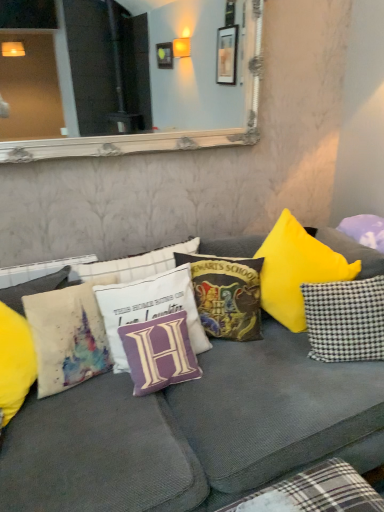
The height and width of the screenshot is (512, 384). I want to click on purple fabric pillow at center, which appears as the 3th pillow when viewed from the left, so click(159, 353).

The width and height of the screenshot is (384, 512). What do you see at coordinates (192, 430) in the screenshot?
I see `textured gray couch at center` at bounding box center [192, 430].

What is the approximate height of velvet hogwarts school of witchcraft and wizardry pillow at center, the 3th pillow from the right?

It is 15.96 inches.

What do you see at coordinates (149, 308) in the screenshot?
I see `white fabric pillow with purple letter h at center, the 5th pillow when ordered from right to left` at bounding box center [149, 308].

The height and width of the screenshot is (512, 384). What are the coordinates of `checkered fabric pillow at right, marked as the second pillow in a right-to-left arrangement` in the screenshot? It's located at (345, 319).

You are a GUI agent. You are given a task and a screenshot of the screen. Output one action in this format:
    pyautogui.click(x=<x>, y=<y>)
    Task: Click on the white textured mirror at upper center
    The image size is (384, 512).
    Given the screenshot: What is the action you would take?
    pyautogui.click(x=134, y=140)

Describe the element at coordinates (134, 140) in the screenshot. I see `white textured mirror at upper center` at that location.

What do you see at coordinates (68, 336) in the screenshot? The image size is (384, 512). I see `watercolor fabric pillow at left, which is counted as the 6th pillow, starting from the right` at bounding box center [68, 336].

Find the location of a particular element. The width and height of the screenshot is (384, 512). purple fabric pillow at center, which is the 4th pillow in right-to-left order is located at coordinates (159, 353).

Does point (367, 340) lie in front of point (164, 381)?

That is False.

Is there a large distance between checkered fabric pillow at right, marked as the second pillow in a right-to-left arrangement, and purple fabric pillow at center, which appears as the 3th pillow when viewed from the left?

checkered fabric pillow at right, marked as the second pillow in a right-to-left arrangement, is actually quite close to purple fabric pillow at center, which appears as the 3th pillow when viewed from the left.

Between checkered fabric pillow at right, marked as the second pillow in a right-to-left arrangement, and purple fabric pillow at center, which appears as the 3th pillow when viewed from the left, which one has less height?

purple fabric pillow at center, which appears as the 3th pillow when viewed from the left.

Consider the image. From the image's perspective, which one is positioned lower, checkered fabric pillow at right, which appears as the 5th pillow when viewed from the left, or purple fabric pillow at center, which appears as the 3th pillow when viewed from the left?

From the image's view, purple fabric pillow at center, which appears as the 3th pillow when viewed from the left, is below.

Is white textured mirror at upper center not inside purple fabric pillow at right, the sixth pillow when ordered from left to right?

Yes, white textured mirror at upper center is located beyond the bounds of purple fabric pillow at right, the sixth pillow when ordered from left to right.

Is white textured mirror at upper center turned away from purple fabric pillow at right, the 1th pillow when ordered from right to left?

No, purple fabric pillow at right, the 1th pillow when ordered from right to left, is not at the back of white textured mirror at upper center.

Does point (258, 137) lie behind point (382, 262)?

Yes, it is behind point (382, 262).

From a real-world perspective, which is physically below, white textured mirror at upper center or purple fabric pillow at right, the 1th pillow when ordered from right to left?

In real-world perspective, purple fabric pillow at right, the 1th pillow when ordered from right to left, is lower.

Is checkered fabric pillow at right, which appears as the 5th pillow when viewed from the left, oriented towards purple fabric pillow at right, the sixth pillow when ordered from left to right?

No, checkered fabric pillow at right, which appears as the 5th pillow when viewed from the left, is not oriented towards purple fabric pillow at right, the sixth pillow when ordered from left to right.

From a real-world perspective, between checkered fabric pillow at right, marked as the second pillow in a right-to-left arrangement, and purple fabric pillow at right, the sixth pillow when ordered from left to right, who is vertically higher?

purple fabric pillow at right, the sixth pillow when ordered from left to right, from a real-world perspective.

Is checkered fabric pillow at right, marked as the second pillow in a right-to-left arrangement, inside or outside of purple fabric pillow at right, the 1th pillow when ordered from right to left?

checkered fabric pillow at right, marked as the second pillow in a right-to-left arrangement, is spatially situated outside purple fabric pillow at right, the 1th pillow when ordered from right to left.

Can you tell me how much checkered fabric pillow at right, marked as the second pillow in a right-to-left arrangement, and purple fabric pillow at right, the 1th pillow when ordered from right to left, differ in facing direction?

The angular difference between checkered fabric pillow at right, marked as the second pillow in a right-to-left arrangement, and purple fabric pillow at right, the 1th pillow when ordered from right to left, is 61.4 degrees.

Based on the photo, from the image's perspective, which one is positioned lower, watercolor fabric pillow at left, the first pillow from the left, or white fabric pillow with purple letter h at center, the 5th pillow when ordered from right to left?

watercolor fabric pillow at left, the first pillow from the left, from the image's perspective.

How much distance is there between watercolor fabric pillow at left, which is counted as the 6th pillow, starting from the right, and white fabric pillow with purple letter h at center, the 5th pillow when ordered from right to left?

watercolor fabric pillow at left, which is counted as the 6th pillow, starting from the right, is 6.52 inches away from white fabric pillow with purple letter h at center, the 5th pillow when ordered from right to left.

Locate an element on the screen. the 2nd pillow in front of the white fabric pillow with purple letter h at center, which is the 2th pillow in left-to-right order is located at coordinates (68, 336).

Is watercolor fabric pillow at left, the first pillow from the left, spatially inside white fabric pillow with purple letter h at center, which is the 2th pillow in left-to-right order, or outside of it?

The correct answer is: outside.

From a real-world perspective, between checkered fabric pillow at right, which appears as the 5th pillow when viewed from the left, and textured gray couch at center, who is vertically lower?

textured gray couch at center is physically lower.

Which object is thinner, checkered fabric pillow at right, marked as the second pillow in a right-to-left arrangement, or textured gray couch at center?

With smaller width is checkered fabric pillow at right, marked as the second pillow in a right-to-left arrangement.

Is checkered fabric pillow at right, which appears as the 5th pillow when viewed from the left, closer to the viewer compared to textured gray couch at center?

No, it is behind textured gray couch at center.

From a real-world perspective, who is located higher, watercolor fabric pillow at left, which is counted as the 6th pillow, starting from the right, or checkered fabric pillow at right, which appears as the 5th pillow when viewed from the left?

In real-world perspective, watercolor fabric pillow at left, which is counted as the 6th pillow, starting from the right, is above.

From the image's perspective, between watercolor fabric pillow at left, the first pillow from the left, and checkered fabric pillow at right, marked as the second pillow in a right-to-left arrangement, who is located below?

watercolor fabric pillow at left, the first pillow from the left, from the image's perspective.

Considering the sizes of objects watercolor fabric pillow at left, which is counted as the 6th pillow, starting from the right, and checkered fabric pillow at right, marked as the second pillow in a right-to-left arrangement, in the image provided, who is smaller, watercolor fabric pillow at left, which is counted as the 6th pillow, starting from the right, or checkered fabric pillow at right, marked as the second pillow in a right-to-left arrangement,?

Smaller between the two is checkered fabric pillow at right, marked as the second pillow in a right-to-left arrangement.

Which is behind, watercolor fabric pillow at left, which is counted as the 6th pillow, starting from the right, or checkered fabric pillow at right, which appears as the 5th pillow when viewed from the left?

checkered fabric pillow at right, which appears as the 5th pillow when viewed from the left, is behind.

How different are the orientations of purple fabric pillow at center, which is the 4th pillow in right-to-left order, and checkered fabric pillow at right, marked as the second pillow in a right-to-left arrangement, in degrees?

The angular difference between purple fabric pillow at center, which is the 4th pillow in right-to-left order, and checkered fabric pillow at right, marked as the second pillow in a right-to-left arrangement, is 28.6 degrees.

Considering their positions, is purple fabric pillow at center, which is the 4th pillow in right-to-left order, located in front of or behind checkered fabric pillow at right, marked as the second pillow in a right-to-left arrangement?

purple fabric pillow at center, which is the 4th pillow in right-to-left order, is in front of checkered fabric pillow at right, marked as the second pillow in a right-to-left arrangement.

Is purple fabric pillow at center, which appears as the 3th pillow when viewed from the left, placed right next to checkered fabric pillow at right, which appears as the 5th pillow when viewed from the left?

No, purple fabric pillow at center, which appears as the 3th pillow when viewed from the left, is not next to checkered fabric pillow at right, which appears as the 5th pillow when viewed from the left.

Locate an element on the screen. The image size is (384, 512). pillow that is the 2nd one when counting backward from the purple fabric pillow at center, which is the 4th pillow in right-to-left order is located at coordinates (345, 319).

The image size is (384, 512). I want to click on the 2nd pillow to the left of the checkered fabric pillow at right, marked as the second pillow in a right-to-left arrangement, starting your count from the anchor, so click(159, 353).

This screenshot has width=384, height=512. In order to click on mirror that is above the purple fabric pillow at right, the 1th pillow when ordered from right to left (from the image's perspective) in this screenshot , I will do `click(134, 140)`.

Looking at this image, based on their spatial positions, is textured gray couch at center or white fabric pillow with purple letter h at center, which is the 2th pillow in left-to-right order, further from watercolor fabric pillow at left, the first pillow from the left?

textured gray couch at center is further to watercolor fabric pillow at left, the first pillow from the left.

Based on their spatial positions, is white fabric pillow with purple letter h at center, which is the 2th pillow in left-to-right order, or checkered fabric pillow at right, which appears as the 5th pillow when viewed from the left, further from white textured mirror at upper center?

The object further to white textured mirror at upper center is checkered fabric pillow at right, which appears as the 5th pillow when viewed from the left.

Looking at the image, which one is located closer to white textured mirror at upper center, white fabric pillow with purple letter h at center, the 5th pillow when ordered from right to left, or purple fabric pillow at center, which appears as the 3th pillow when viewed from the left?

white fabric pillow with purple letter h at center, the 5th pillow when ordered from right to left, is closer to white textured mirror at upper center.

Based on their spatial positions, is checkered fabric pillow at right, which appears as the 5th pillow when viewed from the left, or white textured mirror at upper center further from textured gray couch at center?

The object further to textured gray couch at center is white textured mirror at upper center.

Based on the photo, based on their spatial positions, is textured gray couch at center or white fabric pillow with purple letter h at center, which is the 2th pillow in left-to-right order, further from purple fabric pillow at center, which appears as the 3th pillow when viewed from the left?

textured gray couch at center.

Estimate the real-world distances between objects in this image. Which object is closer to checkered fabric pillow at right, marked as the second pillow in a right-to-left arrangement, textured gray couch at center or velvet hogwarts school of witchcraft and wizardry pillow at center, the 4th pillow viewed from the left?

textured gray couch at center lies closer to checkered fabric pillow at right, marked as the second pillow in a right-to-left arrangement, than the other object.

Which object lies further to the anchor point white textured mirror at upper center, white fabric pillow with purple letter h at center, which is the 2th pillow in left-to-right order, or textured gray couch at center?

Based on the image, textured gray couch at center appears to be further to white textured mirror at upper center.

Based on their spatial positions, is watercolor fabric pillow at left, which is counted as the 6th pillow, starting from the right, or purple fabric pillow at right, the sixth pillow when ordered from left to right, closer to velvet hogwarts school of witchcraft and wizardry pillow at center, the 3th pillow from the right?

purple fabric pillow at right, the sixth pillow when ordered from left to right, is closer to velvet hogwarts school of witchcraft and wizardry pillow at center, the 3th pillow from the right.

At what (x,y) coordinates should I click in order to perform the action: click on pillow between white fabric pillow with purple letter h at center, the 5th pillow when ordered from right to left, and velvet hogwarts school of witchcraft and wizardry pillow at center, the 3th pillow from the right, in the horizontal direction. Please return your answer as a coordinate pair (x, y). The height and width of the screenshot is (512, 384). Looking at the image, I should click on (159, 353).

At what (x,y) coordinates should I click in order to perform the action: click on studio couch between purple fabric pillow at center, which appears as the 3th pillow when viewed from the left, and checkered fabric pillow at right, marked as the second pillow in a right-to-left arrangement, in the horizontal direction. Please return your answer as a coordinate pair (x, y). This screenshot has width=384, height=512. Looking at the image, I should click on (192, 430).

Where is `studio couch between white fabric pillow with purple letter h at center, the 5th pillow when ordered from right to left, and purple fabric pillow at right, the sixth pillow when ordered from left to right`? Image resolution: width=384 pixels, height=512 pixels. studio couch between white fabric pillow with purple letter h at center, the 5th pillow when ordered from right to left, and purple fabric pillow at right, the sixth pillow when ordered from left to right is located at coordinates (192, 430).

You are a GUI agent. You are given a task and a screenshot of the screen. Output one action in this format:
    pyautogui.click(x=<x>, y=<y>)
    Task: Click on the studio couch between purple fabric pillow at center, which appears as the 3th pillow when viewed from the left, and purple fabric pillow at right, the 1th pillow when ordered from right to left
    
    Given the screenshot: What is the action you would take?
    pyautogui.click(x=192, y=430)